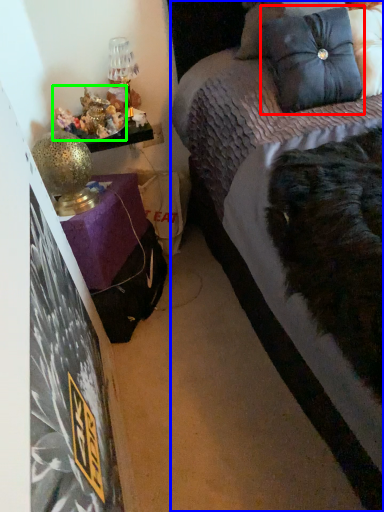
Question: Considering the real-world distances, which object is farthest from pillow (highlighted by a red box)? bed (highlighted by a blue box) or stuff (highlighted by a green box)?

Choices:
 (A) bed
 (B) stuff

Answer: (A)